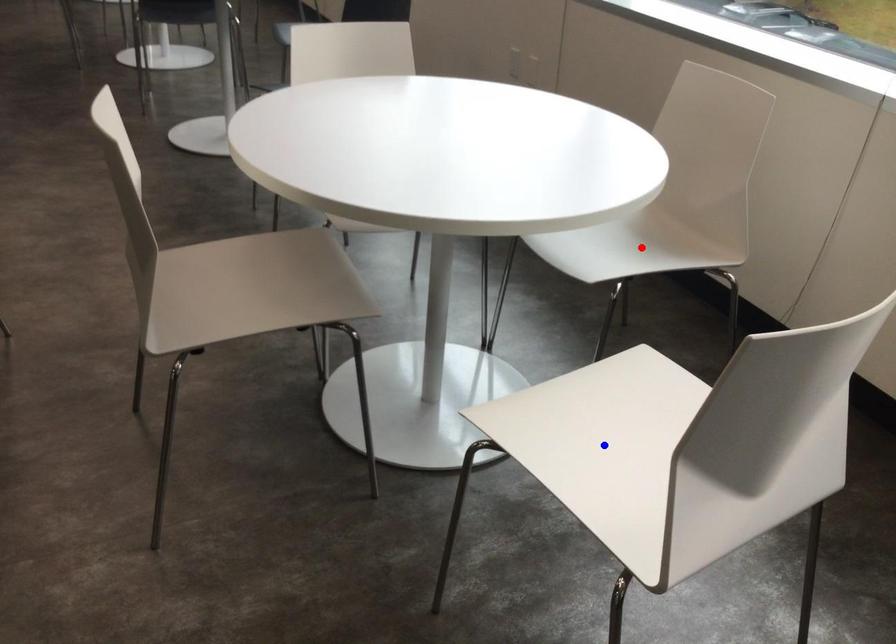
Question: Two points are marked on the image. Which point is closer to the camera?

Choices:
 (A) Blue point is closer.
 (B) Red point is closer.

Answer: (A)